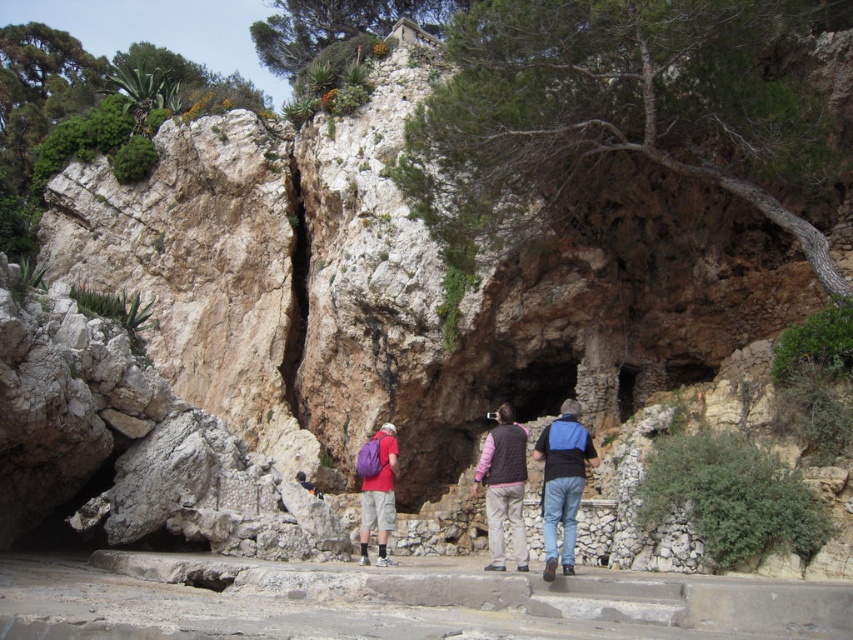
Question: Which point appears farthest from the camera in this image?

Choices:
 (A) (358, 540)
 (B) (566, 547)

Answer: (A)

Question: Which point is farther to the camera?

Choices:
 (A) (541, 435)
 (B) (497, 481)

Answer: (A)

Question: Which object appears farthest from the camera in this image?

Choices:
 (A) blue fabric backpack at center
 (B) pink fleece vest at center

Answer: (B)

Question: Is blue fabric backpack at center bigger than pink fleece vest at center?

Choices:
 (A) yes
 (B) no

Answer: (A)

Question: Is blue fabric backpack at center to the right of purple fabric backpack at center from the viewer's perspective?

Choices:
 (A) no
 (B) yes

Answer: (B)

Question: Can you confirm if pink fleece vest at center is bigger than purple fabric backpack at center?

Choices:
 (A) yes
 (B) no

Answer: (A)